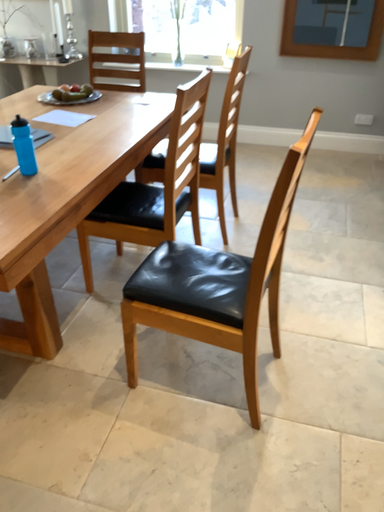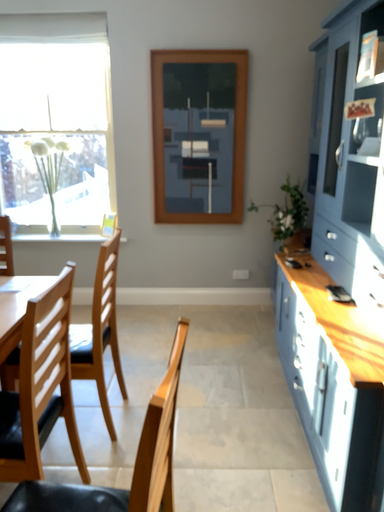
Question: Which way did the camera rotate in the video?

Choices:
 (A) rotated right
 (B) rotated left

Answer: (A)